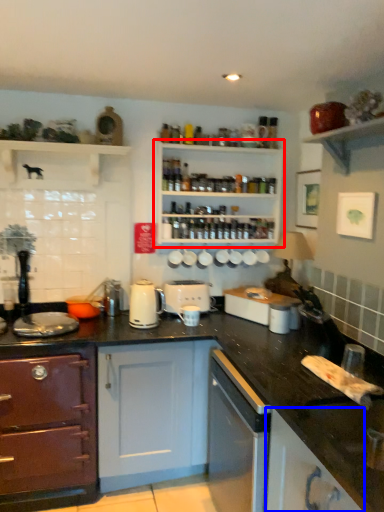
Question: Among these objects, which one is farthest to the camera, shelf (highlighted by a red box) or cabinetry (highlighted by a blue box)?

Choices:
 (A) shelf
 (B) cabinetry

Answer: (A)